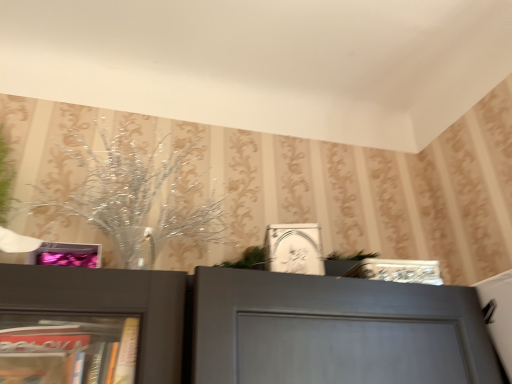
The height and width of the screenshot is (384, 512). I want to click on shiny metallic plant at upper center, so click(138, 198).

What do you see at coordinates (138, 198) in the screenshot? The width and height of the screenshot is (512, 384). I see `shiny metallic plant at upper center` at bounding box center [138, 198].

Where is `shiny metallic plant at upper center`? This screenshot has height=384, width=512. shiny metallic plant at upper center is located at coordinates (138, 198).